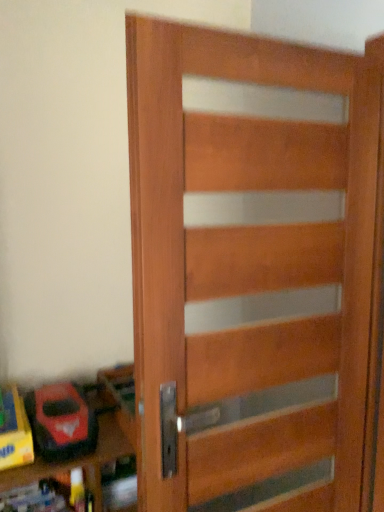
Question: Can you confirm if wooden door at center is shorter than wooden toy box at lower left?

Choices:
 (A) yes
 (B) no

Answer: (B)

Question: From a real-world perspective, is wooden door at center physically below wooden toy box at lower left?

Choices:
 (A) no
 (B) yes

Answer: (A)

Question: Considering the relative positions of wooden door at center and wooden toy box at lower left in the image provided, is wooden door at center behind wooden toy box at lower left?

Choices:
 (A) yes
 (B) no

Answer: (B)

Question: Is wooden door at center not close to wooden toy box at lower left?

Choices:
 (A) no
 (B) yes

Answer: (A)

Question: From the image's perspective, is wooden door at center beneath wooden toy box at lower left?

Choices:
 (A) yes
 (B) no

Answer: (B)

Question: Considering their positions, is wooden toy box at lower left located in front of or behind rubberized red toy car at lower left?

Choices:
 (A) behind
 (B) front

Answer: (B)

Question: In the image, is wooden toy box at lower left on the left side or the right side of rubberized red toy car at lower left?

Choices:
 (A) right
 (B) left

Answer: (A)

Question: Does point (21, 483) appear closer or farther from the camera than point (39, 435)?

Choices:
 (A) farther
 (B) closer

Answer: (B)

Question: Based on their sizes in the image, would you say wooden toy box at lower left is bigger or smaller than rubberized red toy car at lower left?

Choices:
 (A) big
 (B) small

Answer: (A)

Question: Considering the positions of rubberized red toy car at lower left and wooden door at center in the image, is rubberized red toy car at lower left taller or shorter than wooden door at center?

Choices:
 (A) tall
 (B) short

Answer: (B)

Question: Looking at their shapes, would you say rubberized red toy car at lower left is wider or thinner than wooden door at center?

Choices:
 (A) thin
 (B) wide

Answer: (B)

Question: From a real-world perspective, relative to wooden door at center, is rubberized red toy car at lower left vertically above or below?

Choices:
 (A) above
 (B) below

Answer: (B)

Question: Is rubberized red toy car at lower left situated inside wooden door at center or outside?

Choices:
 (A) inside
 (B) outside

Answer: (B)

Question: Looking at the image, does wooden door at center seem bigger or smaller compared to wooden toy box at lower left?

Choices:
 (A) big
 (B) small

Answer: (B)

Question: Considering the positions of wooden door at center and wooden toy box at lower left in the image, is wooden door at center taller or shorter than wooden toy box at lower left?

Choices:
 (A) tall
 (B) short

Answer: (A)